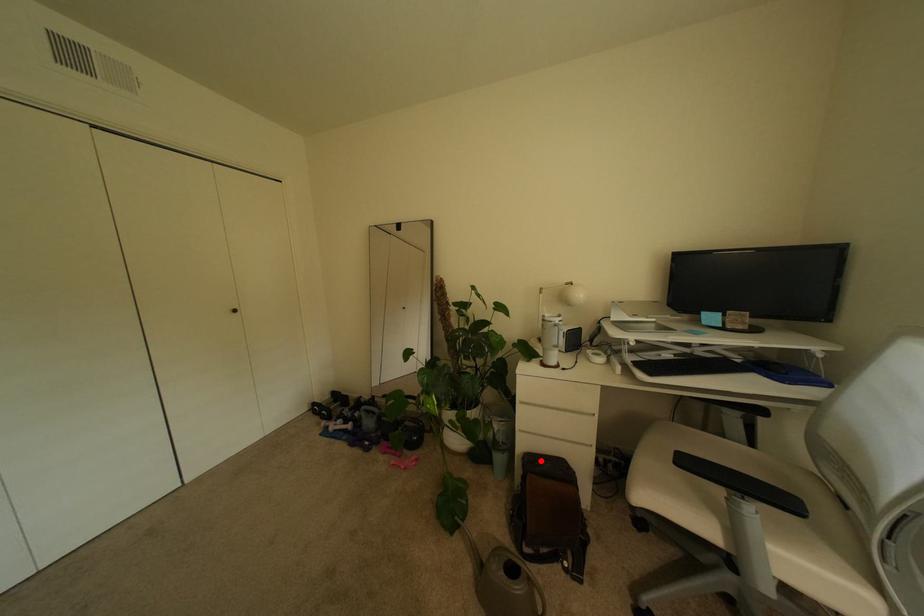
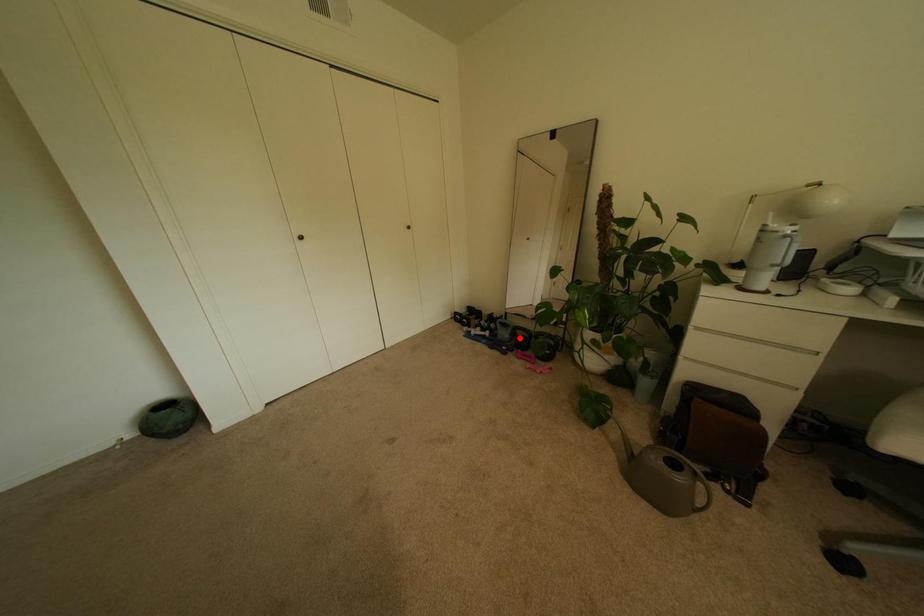
I am providing you with two images of the same scene from different viewpoints. A red point is marked on the first image and another point is marked on the second image. Is the marked point in image1 the same physical position as the marked point in image2?

No